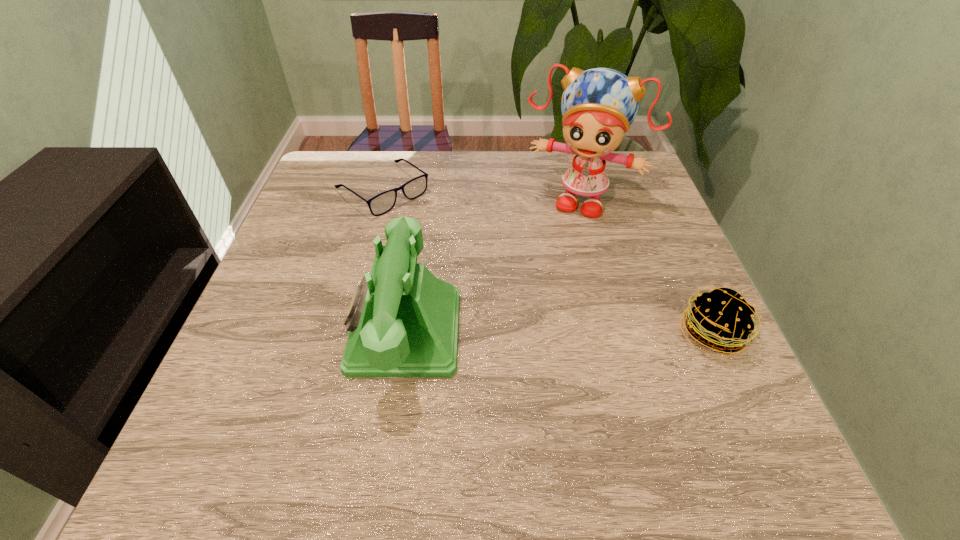
You are a GUI agent. You are given a task and a screenshot of the screen. Output one action in this format:
    pyautogui.click(x=<x>, y=<y>)
    Task: Click on the free space that satisfies the following two spatial constraints: 1. on the front side of the second tallest object; 2. on the dial of the shortest object
    This screenshot has height=540, width=960.
    Given the screenshot: What is the action you would take?
    pyautogui.click(x=346, y=331)